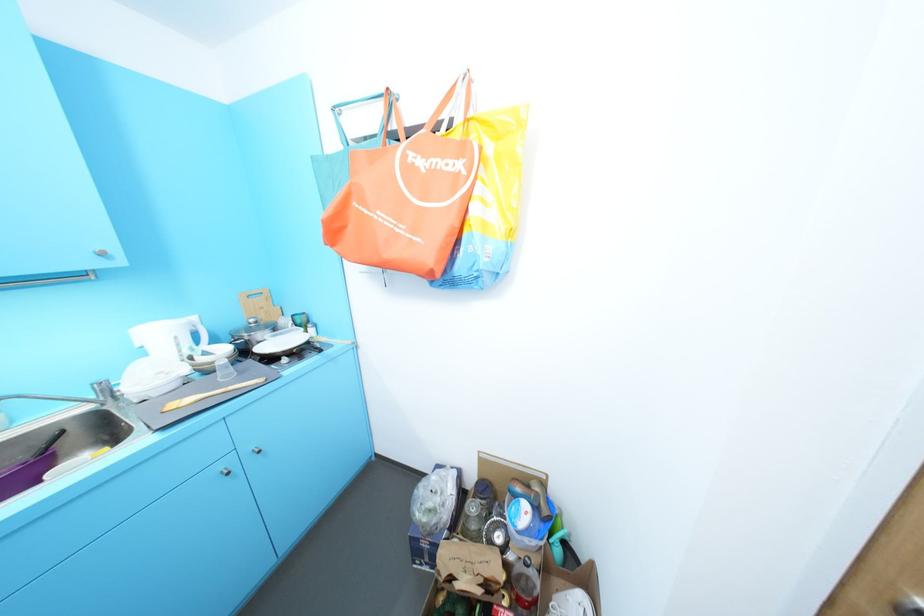
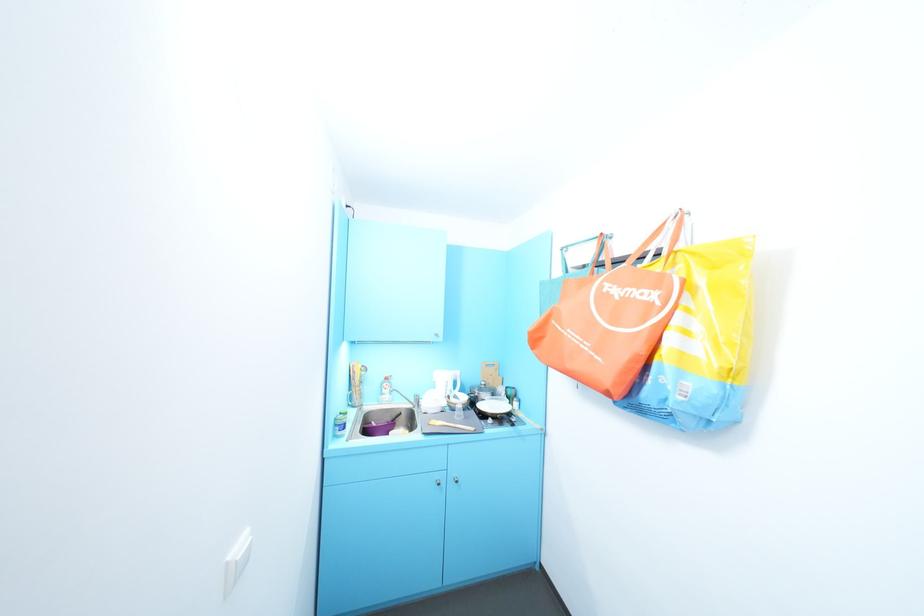
Where in the second image is the point corresponding to the point at 179,406 from the first image?

(440, 423)